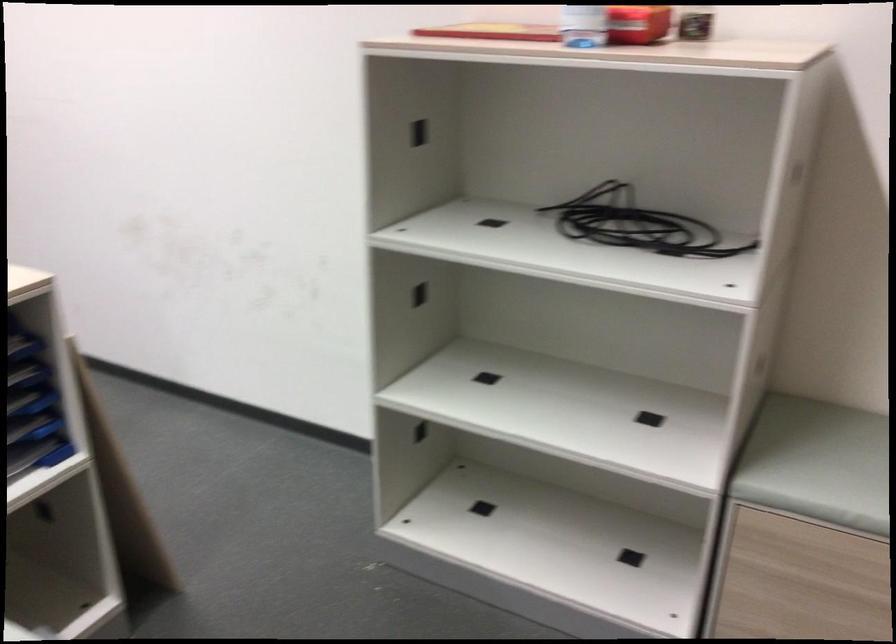
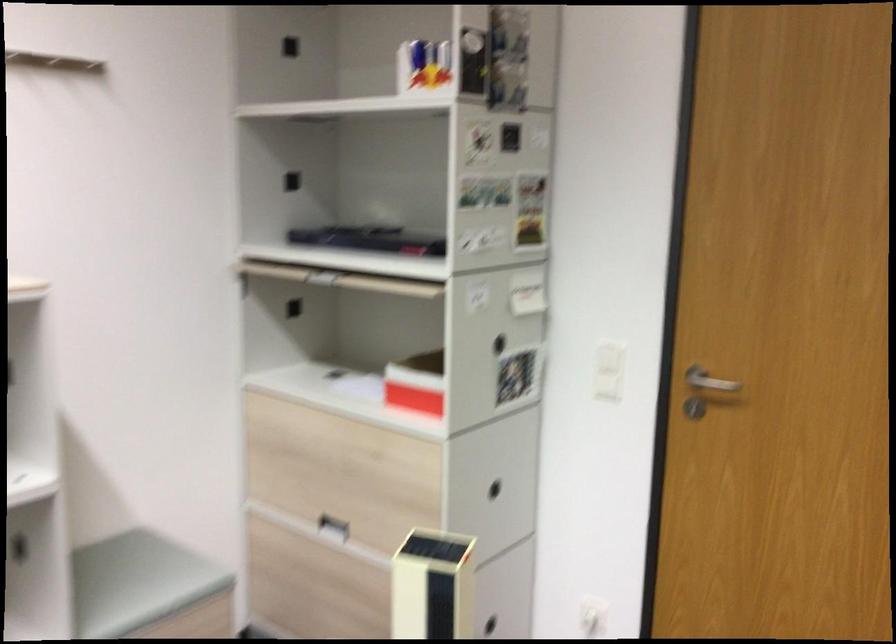
Question: The camera is either moving clockwise (left) or counter-clockwise (right) around the object. The first image is from the beginning of the video and the second image is from the end. Is the camera moving left or right when shooting the video?

Choices:
 (A) Left
 (B) Right

Answer: (A)